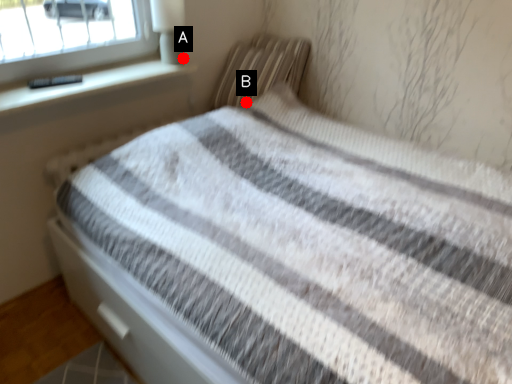
Question: Two points are circled on the image, labeled by A and B beside each circle. Which point is farther from the camera taking this photo?

Choices:
 (A) A is further
 (B) B is further

Answer: (B)